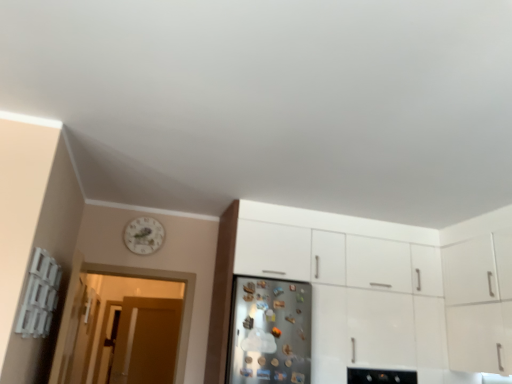
Question: Is white glossy clock at upper left inside brown matte door at left?

Choices:
 (A) yes
 (B) no

Answer: (B)

Question: Is brown matte door at left oriented away from white glossy clock at upper left?

Choices:
 (A) no
 (B) yes

Answer: (A)

Question: From the image's perspective, does brown matte door at left appear higher than white glossy clock at upper left?

Choices:
 (A) no
 (B) yes

Answer: (A)

Question: Is brown matte door at left oriented towards white glossy clock at upper left?

Choices:
 (A) no
 (B) yes

Answer: (B)

Question: Is brown matte door at left not inside white glossy clock at upper left?

Choices:
 (A) yes
 (B) no

Answer: (A)

Question: Considering the relative sizes of brown matte door at left and white glossy clock at upper left in the image provided, is brown matte door at left shorter than white glossy clock at upper left?

Choices:
 (A) yes
 (B) no

Answer: (B)

Question: From the image's perspective, would you say satin silver fridge at center is positioned over white glossy cabinet at center?

Choices:
 (A) yes
 (B) no

Answer: (B)

Question: Is white glossy cabinet at center surrounded by satin silver fridge at center?

Choices:
 (A) yes
 (B) no

Answer: (B)

Question: Considering the relative positions of satin silver fridge at center and white glossy cabinet at center in the image provided, is satin silver fridge at center to the right of white glossy cabinet at center from the viewer's perspective?

Choices:
 (A) yes
 (B) no

Answer: (B)

Question: Can you confirm if satin silver fridge at center is taller than white glossy cabinet at center?

Choices:
 (A) no
 (B) yes

Answer: (A)

Question: Does satin silver fridge at center have a lesser width compared to white glossy cabinet at center?

Choices:
 (A) yes
 (B) no

Answer: (A)

Question: From a real-world perspective, is satin silver fridge at center below white glossy cabinet at center?

Choices:
 (A) no
 (B) yes

Answer: (B)

Question: Considering the relative sizes of translucent wooden door at left and brown matte door at left in the image provided, is translucent wooden door at left smaller than brown matte door at left?

Choices:
 (A) yes
 (B) no

Answer: (A)